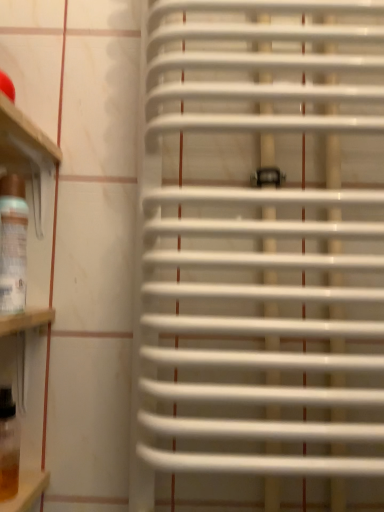
Question: From their relative heights in the image, would you say translucent glass wine bottle at left, which is counted as the 2th wine bottle, starting from the bottom, is taller or shorter than white plastic radiator at center?

Choices:
 (A) short
 (B) tall

Answer: (A)

Question: Looking at their shapes, would you say translucent glass wine bottle at left, the first wine bottle when ordered from top to bottom, is wider or thinner than white plastic radiator at center?

Choices:
 (A) wide
 (B) thin

Answer: (B)

Question: Estimate the real-world distances between objects in this image. Which object is farther from the translucent amber glass at lower left, the 2th wine bottle viewed from the top?

Choices:
 (A) translucent glass wine bottle at left, the first wine bottle when ordered from top to bottom
 (B) white plastic radiator at center

Answer: (B)

Question: Which of these objects is positioned closest to the white plastic radiator at center?

Choices:
 (A) translucent amber glass at lower left, placed as the first wine bottle when sorted from bottom to top
 (B) translucent glass wine bottle at left, the first wine bottle when ordered from top to bottom

Answer: (B)